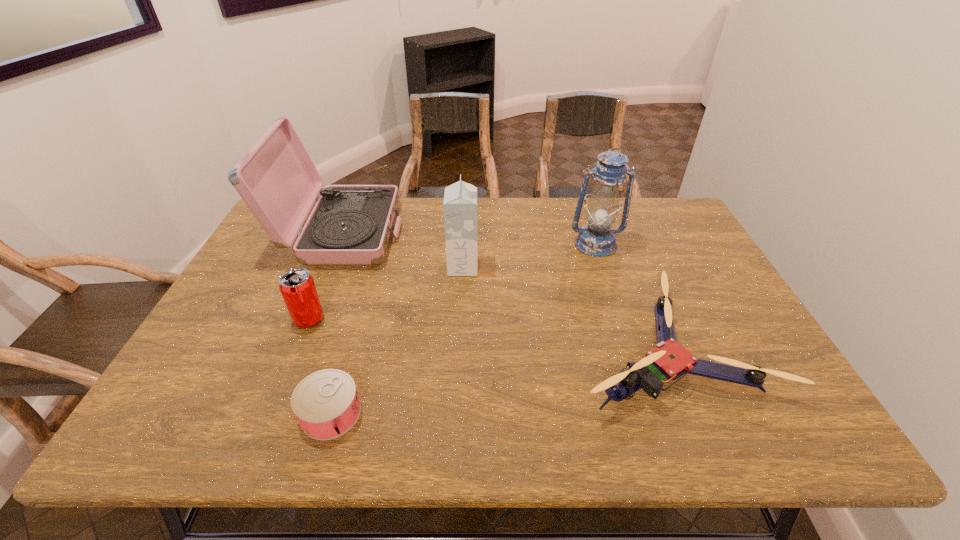
The image size is (960, 540). Find the location of `free space at the far edge`. free space at the far edge is located at coordinates (554, 215).

Find the location of a particular element. This screenshot has height=540, width=960. free space at the near edge of the desktop is located at coordinates (606, 416).

Find the location of `vacant space at the left edge`. vacant space at the left edge is located at coordinates (238, 379).

Identify the location of blank space at the right edge. The image size is (960, 540). (691, 287).

What are the coordinates of `free space between the second shortest object and the third object from right to left` in the screenshot? It's located at (564, 307).

I want to click on free area in between the soda can and the record player, so click(x=325, y=276).

Identify the location of unoccupied position between the can and the lantern. Image resolution: width=960 pixels, height=540 pixels. (463, 329).

The image size is (960, 540). In order to click on vacant area that lies between the lantern and the drone in this screenshot , I will do `click(631, 295)`.

Where is `free space between the shortest object and the soda can`? free space between the shortest object and the soda can is located at coordinates (320, 367).

Identify the location of free space between the record player and the third object from right to left. point(402,250).